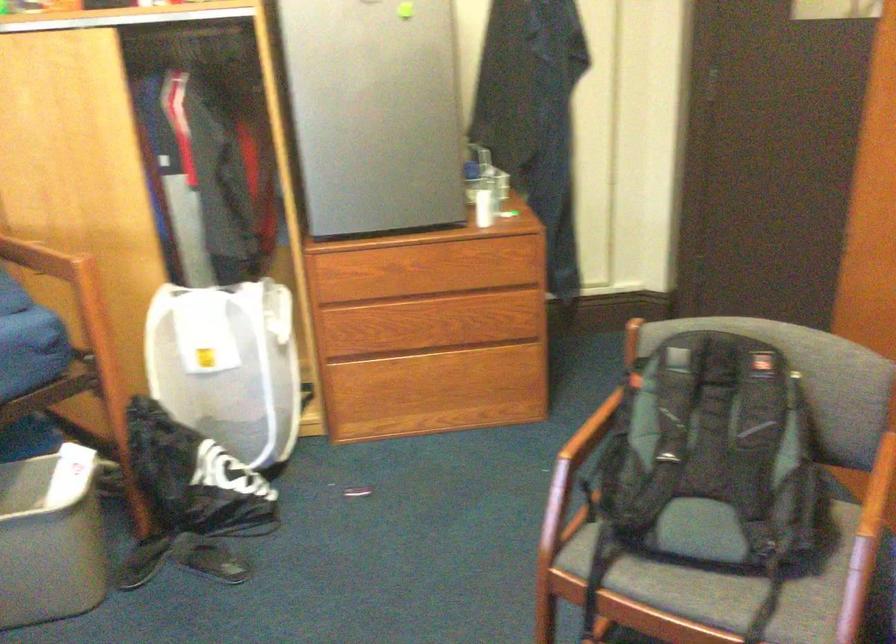
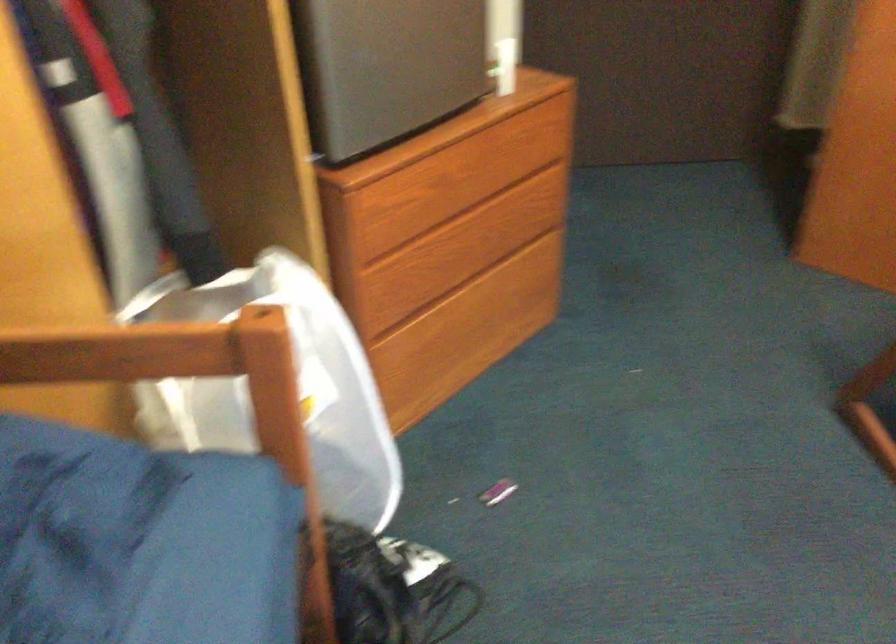
Where in the second image is the point corresponding to [416,348] from the first image?

(451, 279)